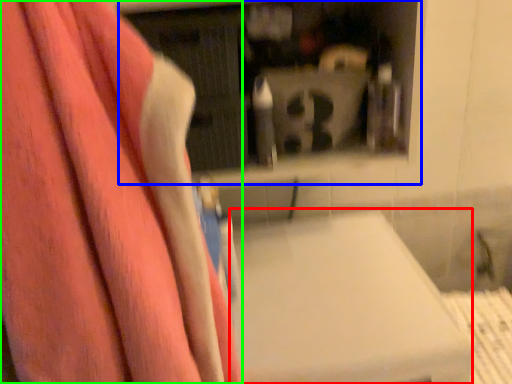
Question: Based on their relative distances, which object is farther from lift (highlighted by a red box)? Choose from shelf (highlighted by a blue box) and towel (highlighted by a green box).

Choices:
 (A) shelf
 (B) towel

Answer: (A)